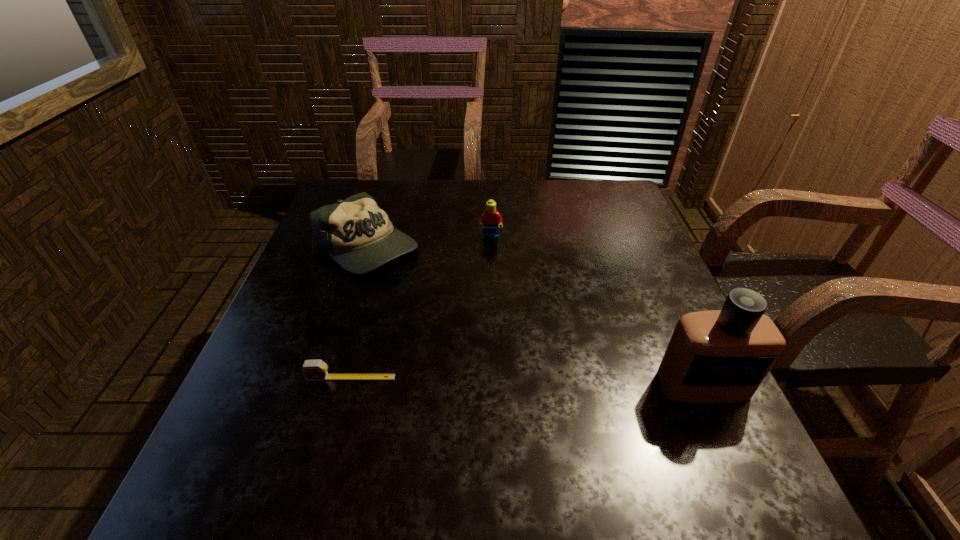
Locate an element on the screen. vacant spot on the desktop that is between the tape measure and the rightmost object and is positioned on the face of the Lego is located at coordinates (499, 381).

The width and height of the screenshot is (960, 540). I want to click on vacant space on the desktop that is between the shortest object and the perfume and is positioned on the front-facing side of the baseball cap, so click(x=481, y=380).